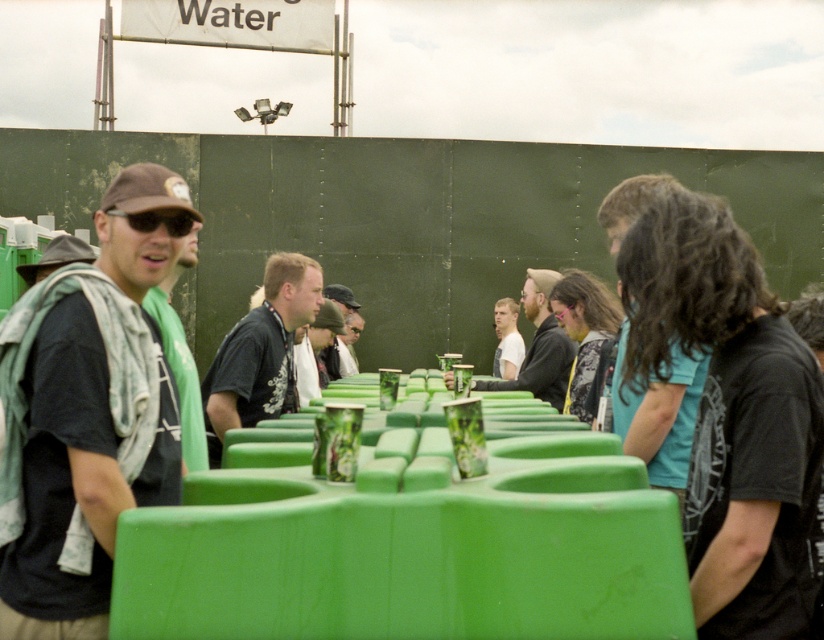
How far apart are dark gray fabric jacket at center and white matte shirt at center?

8.52 feet

Who is higher up, dark gray fabric jacket at center or white matte shirt at center?

dark gray fabric jacket at center

Does point (336, 371) come closer to viewer compared to point (513, 369)?

That is True.

The width and height of the screenshot is (824, 640). Identify the location of dark gray fabric jacket at center. coord(342,333).

Is point (302, 268) positioned in front of point (515, 332)?

Yes, point (302, 268) is closer to viewer.

The height and width of the screenshot is (640, 824). Describe the element at coordinates (260, 349) in the screenshot. I see `black matte shirt at center` at that location.

The width and height of the screenshot is (824, 640). What do you see at coordinates (260, 349) in the screenshot?
I see `black matte shirt at center` at bounding box center [260, 349].

I want to click on black matte shirt at center, so click(260, 349).

Is matte black shirt at center above dark gray fabric jacket at center?

Yes.

Does matte black shirt at center come behind dark gray fabric jacket at center?

No, it is in front of dark gray fabric jacket at center.

Between point (537, 392) and point (340, 285), which one is positioned in front?

Positioned in front is point (537, 392).

Where is `matte black shirt at center`? The image size is (824, 640). matte black shirt at center is located at coordinates (541, 346).